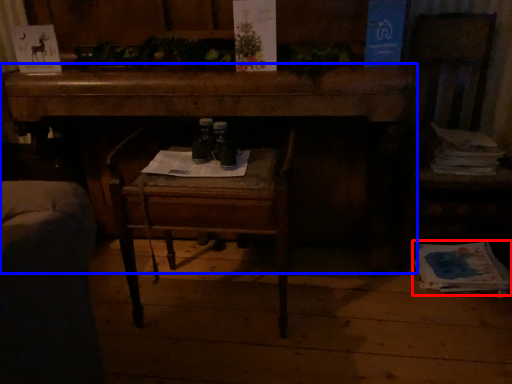
Question: Which object is closer to the camera taking this photo, magazine (highlighted by a red box) or desk (highlighted by a blue box)?

Choices:
 (A) magazine
 (B) desk

Answer: (B)